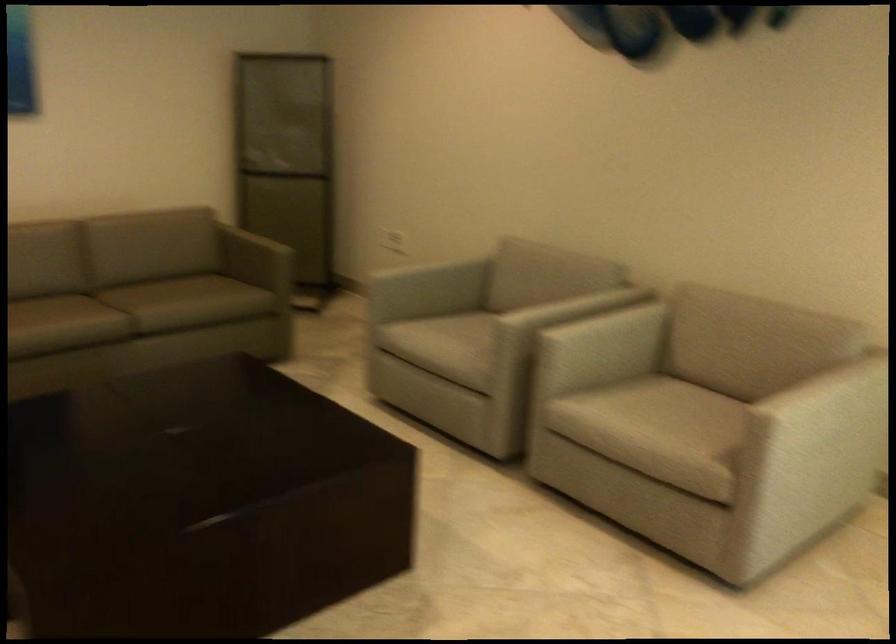
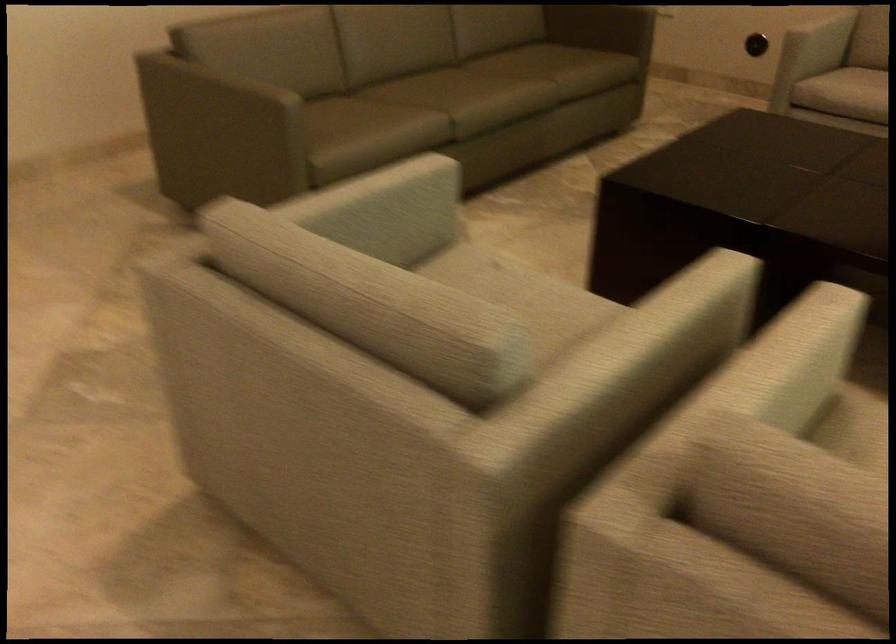
Question: What movement of the cameraman would produce the second image?

Choices:
 (A) Left
 (B) Right
 (C) Forward
 (D) Backward

Answer: (A)